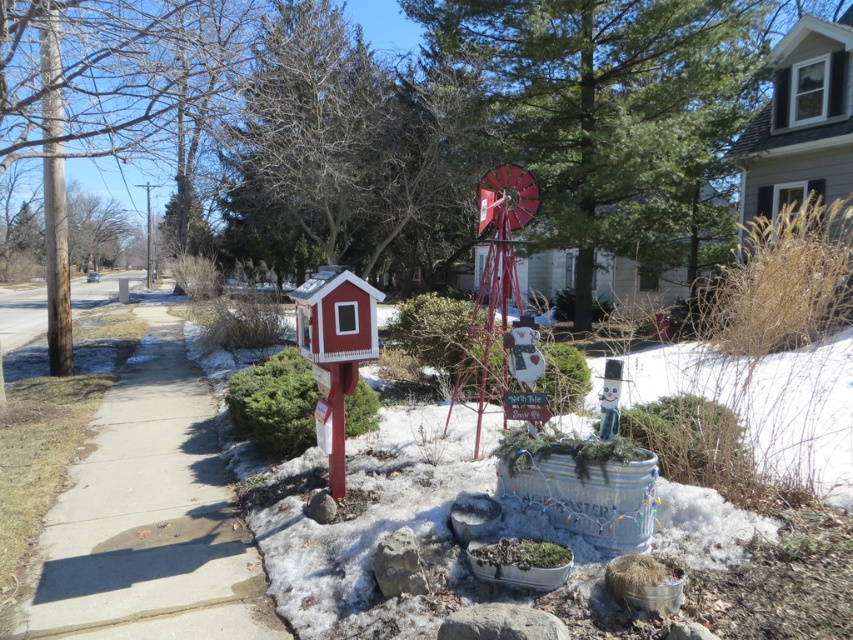
Which is in front, point (228, 580) or point (61, 260)?

Point (228, 580) is more forward.

Is concrete sidewalk at center bigger than brown wood pole at left?

Incorrect, concrete sidewalk at center is not larger than brown wood pole at left.

Identify the location of concrete sidewalk at center. This screenshot has width=853, height=640. (149, 515).